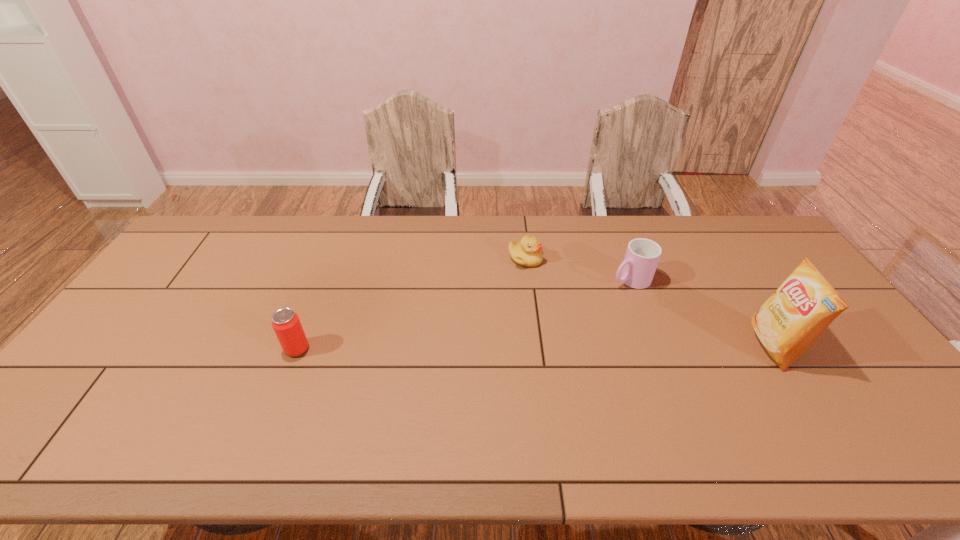
This screenshot has height=540, width=960. I want to click on free space on the desktop that is between the beer can and the rightmost object and is positioned on the front-facing side of the shortest object, so click(x=599, y=347).

Image resolution: width=960 pixels, height=540 pixels. Identify the location of free spot on the desktop that is between the leftmost object and the rightmost object and is positioned with the handle on the side of the cup. (488, 348).